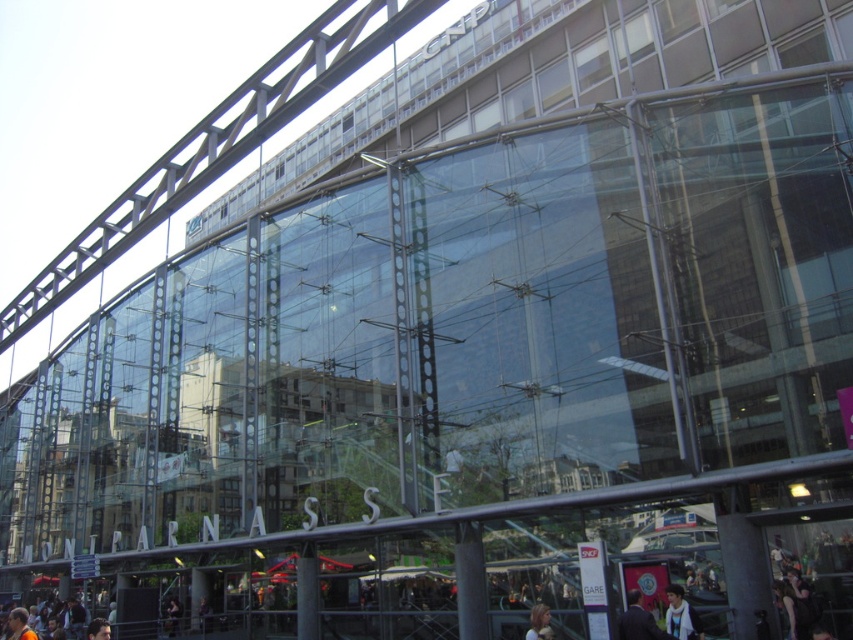
You are standing at the entrance of Gare Montparnasse and want to locate two specific points marked on a map. The first point is at coordinates point (672, 628), and the second is at point (534, 628). According to the spatial relationship between these points, which one is closer to you when facing the station entrance?

Point (672, 628) is in front of point (534, 628), so when facing the station entrance, point (672, 628) is closer to you.

You are a photographer standing at the entrance of Gare Montparnasse. You notice a person wearing a blue denim jacket at lower right and another person with blonde hair at lower center. Which of these two people is more likely to block your view of the station sign if they move closer to you?

The blue denim jacket at lower right is wider than blonde hair at lower center, so the person wearing the blue denim jacket at lower right is more likely to block your view of the station sign if they move closer to you.

You are an observer standing at the entrance of Montparnasse Station. You notice two people in the scene. One is wearing a dark blue suit at lower right, and the other has blonde hair at lower center. Which person appears larger in size?

The dark blue suit at lower right is bigger than blonde hair at lower center, so the person wearing the dark blue suit at lower right appears larger in size.